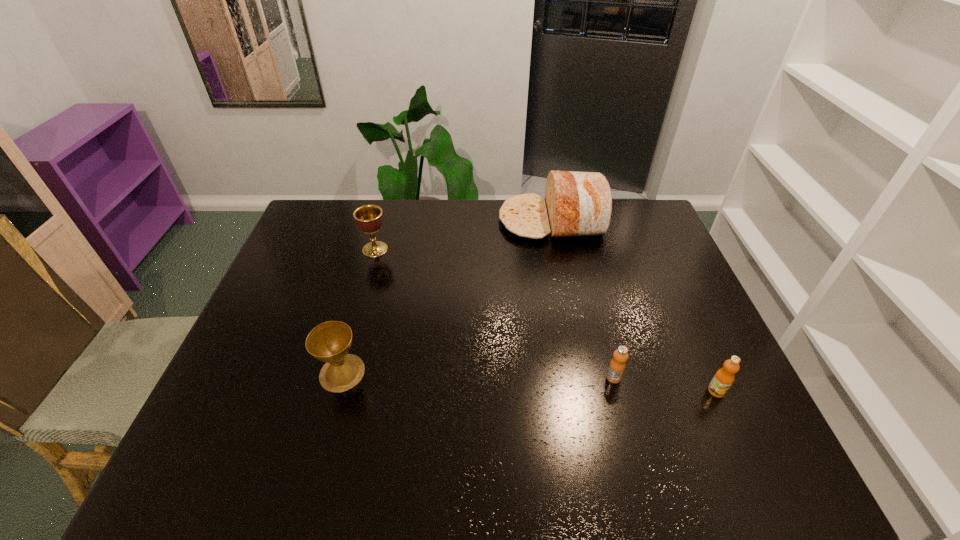
Where is `free space that is in between the farther chalice and the left orange juice`? free space that is in between the farther chalice and the left orange juice is located at coordinates (494, 314).

Identify the location of free space between the nearer chalice and the left orange juice. Image resolution: width=960 pixels, height=540 pixels. (478, 375).

The width and height of the screenshot is (960, 540). Find the location of `empty space between the rightmost object and the tallest object`. empty space between the rightmost object and the tallest object is located at coordinates (635, 306).

Where is `blank region between the left orange juice and the nearer chalice`? This screenshot has width=960, height=540. blank region between the left orange juice and the nearer chalice is located at coordinates (478, 375).

Where is `free spot between the rightmost object and the left orange juice`? The height and width of the screenshot is (540, 960). free spot between the rightmost object and the left orange juice is located at coordinates (665, 384).

Identify the location of vacant space that is in between the rightmost object and the farther chalice. (546, 320).

Image resolution: width=960 pixels, height=540 pixels. I want to click on vacant area between the bread and the nearer chalice, so click(447, 296).

Locate an element on the screen. This screenshot has width=960, height=540. free area in between the farther chalice and the tallest object is located at coordinates (464, 235).

Find the location of `empty space that is in between the rightmost object and the left orange juice`. empty space that is in between the rightmost object and the left orange juice is located at coordinates [665, 384].

Point out which object is positioned as the third nearest to the left orange juice. Please provide its 2D coordinates. Your answer should be formatted as a tuple, i.e. [(x, y)], where the tuple contains the x and y coordinates of a point satisfying the conditions above.

[(329, 342)]